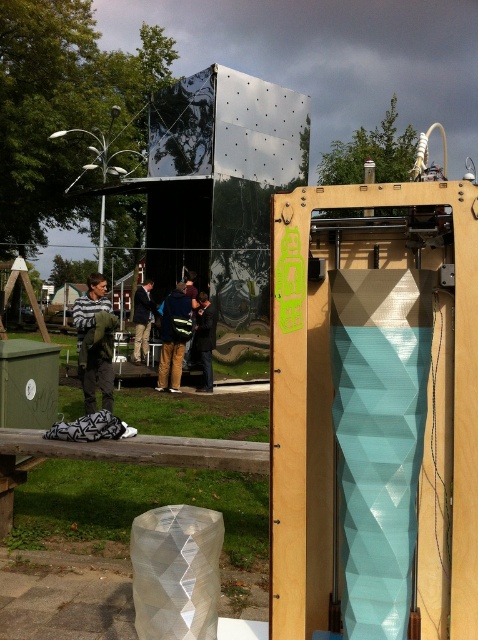
Which is above, dark blue backpack at center or reflective metallic jacket at center?

Positioned higher is reflective metallic jacket at center.

Can you confirm if dark blue backpack at center is thinner than reflective metallic jacket at center?

No.

Is point (191, 320) closer to viewer compared to point (187, 278)?

Yes, it is in front of point (187, 278).

I want to click on dark blue backpack at center, so click(173, 337).

Can you confirm if dark blue jacket at center is positioned below reflective metallic jacket at center?

Yes.

Does dark blue jacket at center lie behind reflective metallic jacket at center?

That is True.

Who is more distant from viewer, (201, 339) or (193, 296)?

The point (193, 296) is behind.

Identify the location of dark blue jacket at center. (205, 339).

Does dark blue jacket at center have a greater height compared to dark blue jeans at center?

Correct, dark blue jacket at center is much taller as dark blue jeans at center.

Is dark blue jacket at center bigger than dark blue jeans at center?

Incorrect, dark blue jacket at center is not larger than dark blue jeans at center.

Identify the location of dark blue jacket at center. (x=205, y=339).